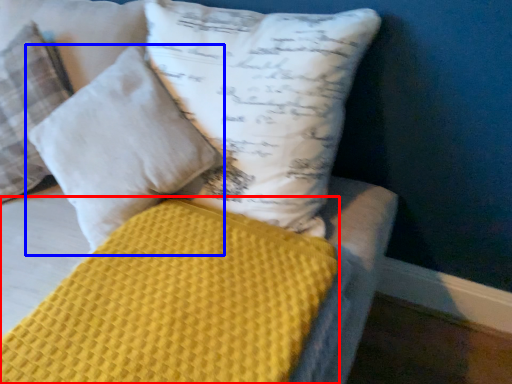
Question: Which point is further to the camera, mattress (highlighted by a red box) or pillow (highlighted by a blue box)?

Choices:
 (A) mattress
 (B) pillow

Answer: (B)